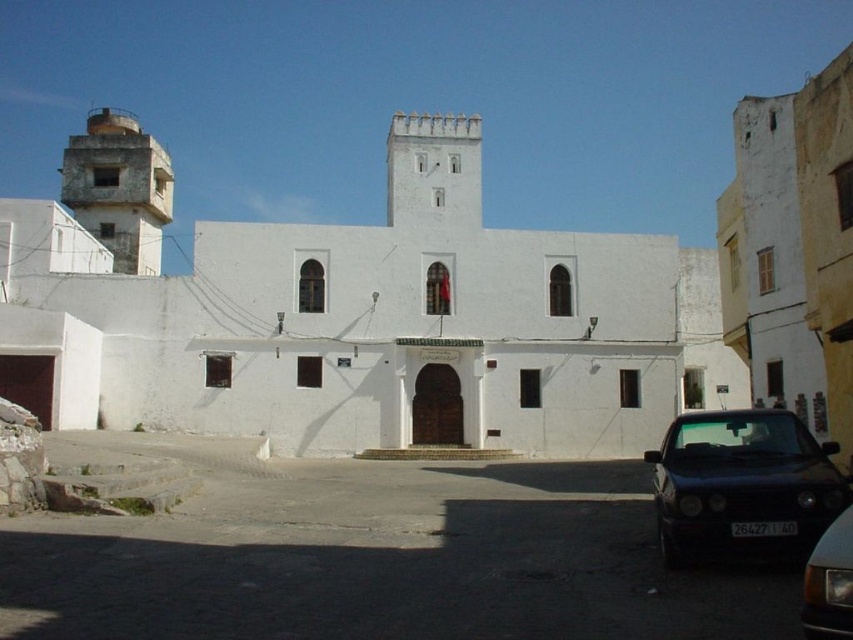
Does point (184, 380) come farther from viewer compared to point (814, 570)?

Yes, it is behind point (814, 570).

Identify the location of white matte building at center. (339, 312).

Describe the element at coordinates (741, 484) in the screenshot. Image resolution: width=853 pixels, height=640 pixels. I see `black glossy car at lower right` at that location.

Which is below, black glossy car at lower right or concrete tower at upper left?

black glossy car at lower right is below.

Measure the distance between point (808, 515) and camera.

They are 71.44 feet apart.

Find the location of a particular element. Image resolution: width=853 pixels, height=640 pixels. black glossy car at lower right is located at coordinates (741, 484).

Does white matte building at center lie behind concrete tower at upper left?

No, white matte building at center is in front of concrete tower at upper left.

Does white matte building at center come in front of concrete tower at upper left?

Yes, white matte building at center is in front of concrete tower at upper left.

You are a GUI agent. You are given a task and a screenshot of the screen. Output one action in this format:
    pyautogui.click(x=<x>, y=<y>)
    Task: Click on the white matte building at center
    
    Given the screenshot: What is the action you would take?
    click(x=339, y=312)

Where is `white matte building at center`? The height and width of the screenshot is (640, 853). white matte building at center is located at coordinates (339, 312).